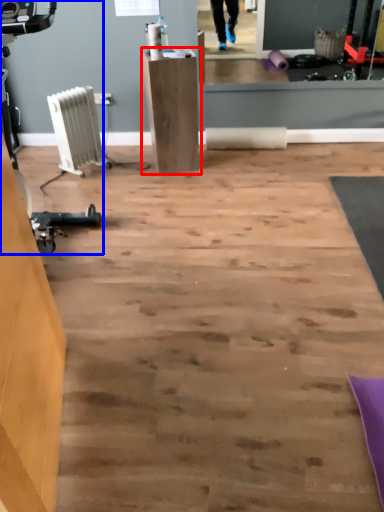
Question: Among these objects, which one is nearest to the camera, furniture (highlighted by a red box) or sport equipment (highlighted by a blue box)?

Choices:
 (A) furniture
 (B) sport equipment

Answer: (B)